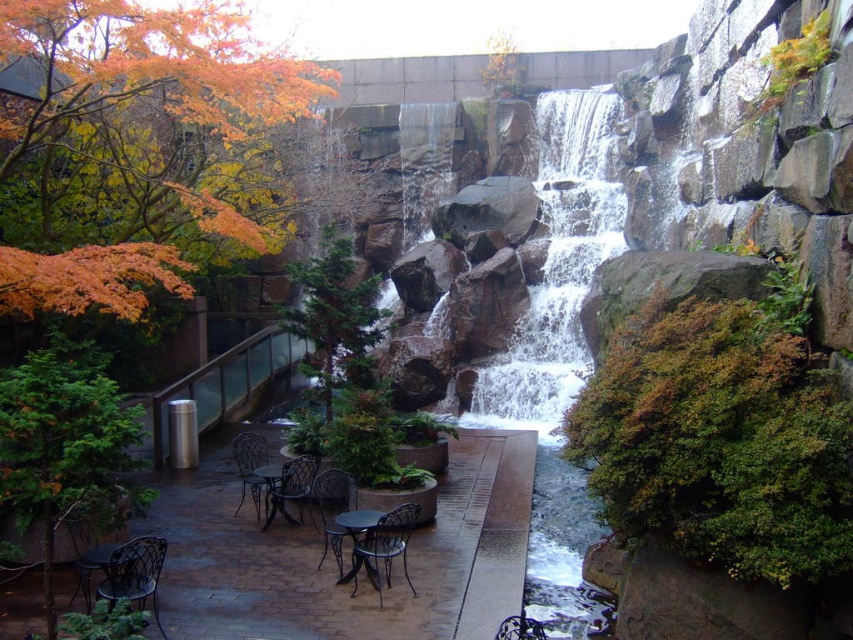
Question: Is the position of dark brown wicker chair at center less distant than that of green metal table at center?

Choices:
 (A) no
 (B) yes

Answer: (A)

Question: Which object is closer to the camera taking this photo?

Choices:
 (A) dark brown wicker chair at center
 (B) metallic dark green chair at lower center

Answer: (B)

Question: Which of these objects is positioned farthest from the metallic black chair at lower center?

Choices:
 (A) brown wooden table at center
 (B) dark brown wicker chair at center
 (C) green metal table at center

Answer: (A)

Question: Is metallic dark green chair at lower center further to camera compared to green metal table at center?

Choices:
 (A) yes
 (B) no

Answer: (B)

Question: Which object is the farthest from the metallic dark brown chair at center?

Choices:
 (A) white textured water at center
 (B) dark brown wicker chair at center
 (C) metallic dark brown table at lower left

Answer: (A)

Question: Can you confirm if white textured water at center is wider than metallic dark brown chair at center?

Choices:
 (A) yes
 (B) no

Answer: (A)